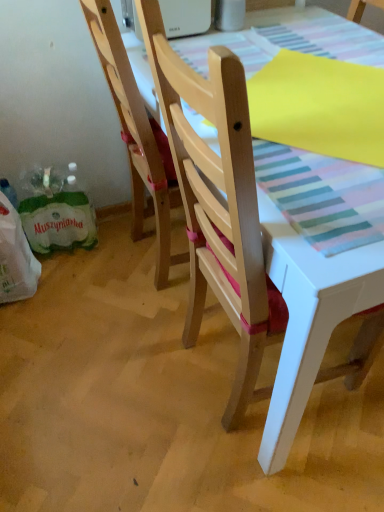
The width and height of the screenshot is (384, 512). In order to click on free space in front of natural wood chair at center, arranged as the second chair when viewed from the right in this screenshot , I will do `click(140, 321)`.